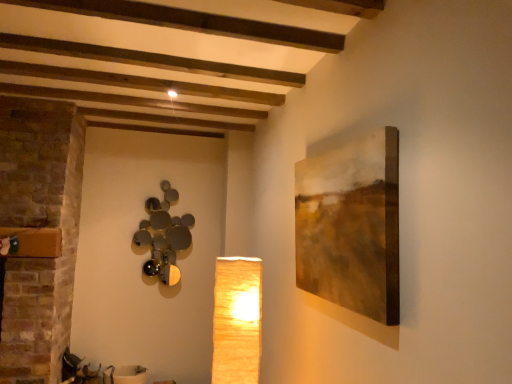
Question: Could you tell me if matte yellow paper lampshade at center, marked as the 2th lamp in a back-to-front arrangement, is facing metallic reflective spheres at upper left, which ranks as the 1th lamp in back-to-front order?

Choices:
 (A) yes
 (B) no

Answer: (B)

Question: Would you say matte yellow paper lampshade at center, positioned as the 1th lamp in front-to-back order, is outside metallic reflective spheres at upper left, which ranks as the 1th lamp in back-to-front order?

Choices:
 (A) no
 (B) yes

Answer: (B)

Question: Does matte yellow paper lampshade at center, positioned as the 1th lamp in front-to-back order, come behind metallic reflective spheres at upper left, positioned as the 1th lamp in left-to-right order?

Choices:
 (A) yes
 (B) no

Answer: (B)

Question: From a real-world perspective, is matte yellow paper lampshade at center, marked as the 2th lamp in a back-to-front arrangement, beneath metallic reflective spheres at upper left, which ranks as the 1th lamp in back-to-front order?

Choices:
 (A) no
 (B) yes

Answer: (B)

Question: Is matte yellow paper lampshade at center, the second lamp viewed from the left, in front of metallic reflective spheres at upper left, positioned as the 1th lamp in left-to-right order?

Choices:
 (A) no
 (B) yes

Answer: (B)

Question: From a real-world perspective, is metallic reflective spheres at upper left, which ranks as the 1th lamp in back-to-front order, above or below matte yellow paper lampshade at center, marked as the 2th lamp in a back-to-front arrangement?

Choices:
 (A) above
 (B) below

Answer: (A)

Question: Considering the relative positions of metallic reflective spheres at upper left, which is counted as the second lamp, starting from the front, and matte yellow paper lampshade at center, marked as the 2th lamp in a back-to-front arrangement, in the image provided, is metallic reflective spheres at upper left, which is counted as the second lamp, starting from the front, to the left or to the right of matte yellow paper lampshade at center, marked as the 2th lamp in a back-to-front arrangement,?

Choices:
 (A) left
 (B) right

Answer: (A)

Question: From the image's perspective, relative to matte yellow paper lampshade at center, positioned as the 1th lamp in front-to-back order, is metallic reflective spheres at upper left, marked as the second lamp in a right-to-left arrangement, above or below?

Choices:
 (A) below
 (B) above

Answer: (B)

Question: Relative to matte yellow paper lampshade at center, the second lamp viewed from the left, is metallic reflective spheres at upper left, which is counted as the second lamp, starting from the front, in front or behind?

Choices:
 (A) front
 (B) behind

Answer: (B)

Question: In the image, is matte brown canvas at right positioned in front of or behind metallic reflective spheres at upper left, which ranks as the 1th lamp in back-to-front order?

Choices:
 (A) front
 (B) behind

Answer: (A)

Question: From a real-world perspective, is matte brown canvas at right above or below metallic reflective spheres at upper left, marked as the second lamp in a right-to-left arrangement?

Choices:
 (A) above
 (B) below

Answer: (A)

Question: Based on their positions, is matte brown canvas at right located to the left or right of metallic reflective spheres at upper left, which is counted as the second lamp, starting from the front?

Choices:
 (A) right
 (B) left

Answer: (A)

Question: From their relative heights in the image, would you say matte brown canvas at right is taller or shorter than metallic reflective spheres at upper left, which is counted as the second lamp, starting from the front?

Choices:
 (A) tall
 (B) short

Answer: (B)

Question: Which is correct: matte yellow paper lampshade at center, the 1th lamp viewed from the right, is inside matte brown canvas at right, or outside of it?

Choices:
 (A) outside
 (B) inside

Answer: (A)

Question: From a real-world perspective, is matte yellow paper lampshade at center, the 1th lamp viewed from the right, physically located above or below matte brown canvas at right?

Choices:
 (A) below
 (B) above

Answer: (A)